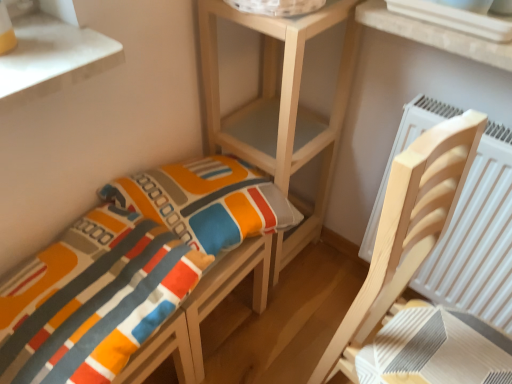
Question: Is white plastic window at upper right not within textured fabric cushion at lower left, acting as the 2th furniture starting from the right?

Choices:
 (A) yes
 (B) no

Answer: (A)

Question: Considering the relative sizes of white plastic window at upper right and textured fabric cushion at lower left, the 1th furniture in the left-to-right sequence, in the image provided, is white plastic window at upper right taller than textured fabric cushion at lower left, the 1th furniture in the left-to-right sequence,?

Choices:
 (A) no
 (B) yes

Answer: (A)

Question: Considering the relative sizes of white plastic window at upper right and textured fabric cushion at lower left, the 1th furniture in the left-to-right sequence, in the image provided, is white plastic window at upper right thinner than textured fabric cushion at lower left, the 1th furniture in the left-to-right sequence,?

Choices:
 (A) yes
 (B) no

Answer: (A)

Question: From a real-world perspective, is white plastic window at upper right located beneath textured fabric cushion at lower left, acting as the 2th furniture starting from the right?

Choices:
 (A) no
 (B) yes

Answer: (A)

Question: From a real-world perspective, is white plastic window at upper right positioned over textured fabric cushion at lower left, the 1th furniture in the left-to-right sequence, based on gravity?

Choices:
 (A) no
 (B) yes

Answer: (B)

Question: Is white plastic window at upper right in contact with textured fabric cushion at lower left, acting as the 2th furniture starting from the right?

Choices:
 (A) yes
 (B) no

Answer: (B)

Question: Is light wood chair at right, the 1th furniture in the right-to-left sequence, aimed at textured fabric cushion at lower left, the 1th furniture in the left-to-right sequence?

Choices:
 (A) yes
 (B) no

Answer: (B)

Question: Is light wood chair at right, acting as the 2th furniture starting from the left, further to the viewer compared to textured fabric cushion at lower left, the 1th furniture in the left-to-right sequence?

Choices:
 (A) no
 (B) yes

Answer: (A)

Question: Does light wood chair at right, the 1th furniture in the right-to-left sequence, appear on the left side of textured fabric cushion at lower left, acting as the 2th furniture starting from the right?

Choices:
 (A) yes
 (B) no

Answer: (B)

Question: Would you say textured fabric cushion at lower left, acting as the 2th furniture starting from the right, is part of light wood chair at right, the 1th furniture in the right-to-left sequence,'s contents?

Choices:
 (A) yes
 (B) no

Answer: (B)

Question: Can you confirm if light wood chair at right, the 1th furniture in the right-to-left sequence, is thinner than textured fabric cushion at lower left, acting as the 2th furniture starting from the right?

Choices:
 (A) no
 (B) yes

Answer: (B)

Question: Can you confirm if light wood chair at right, the 1th furniture in the right-to-left sequence, is bigger than textured fabric cushion at lower left, acting as the 2th furniture starting from the right?

Choices:
 (A) yes
 (B) no

Answer: (A)

Question: Is textured fabric cushion at lower left, the 1th furniture in the left-to-right sequence, smaller than wooden shelf at center?

Choices:
 (A) yes
 (B) no

Answer: (A)